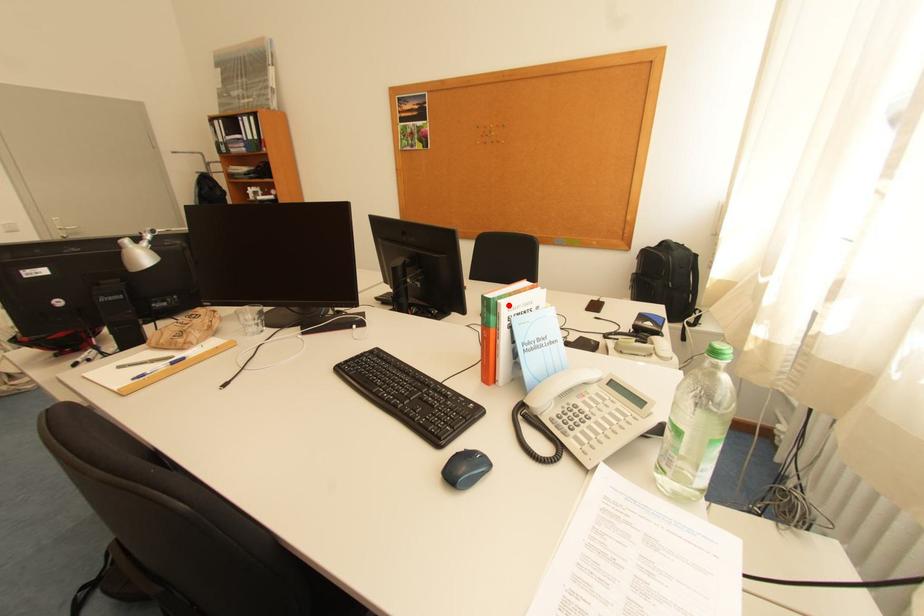
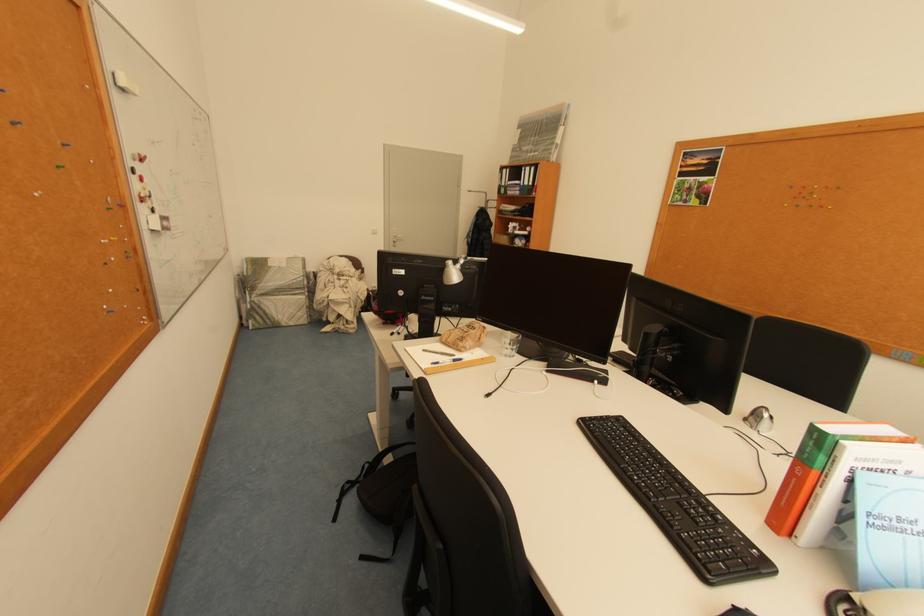
Question: A red point is marked in image1. In image2, is the corresponding 3D point closer to the camera or farther? Reply with the corresponding letter.

Choices:
 (A) The corresponding 3D point is closer.
 (B) The corresponding 3D point is farther.

Answer: (A)